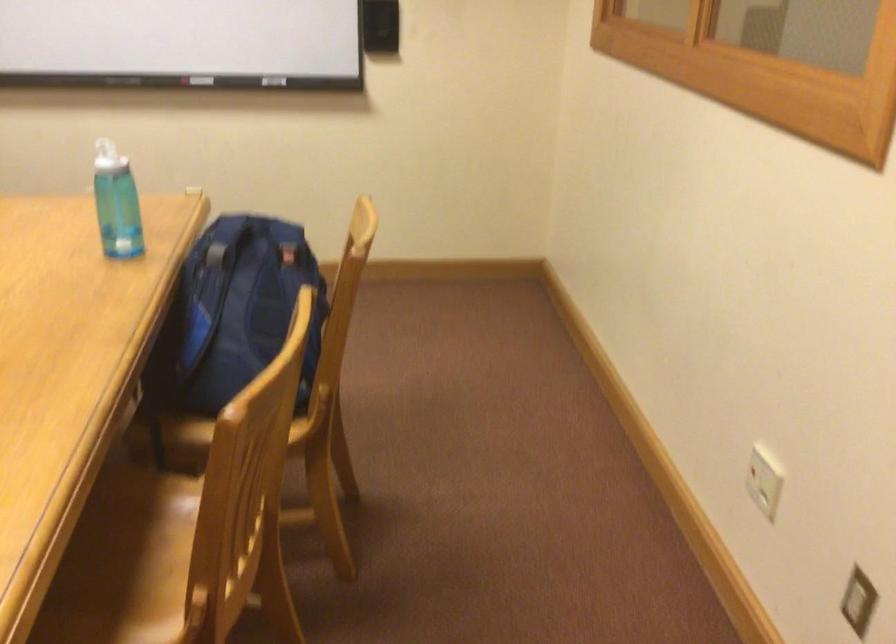
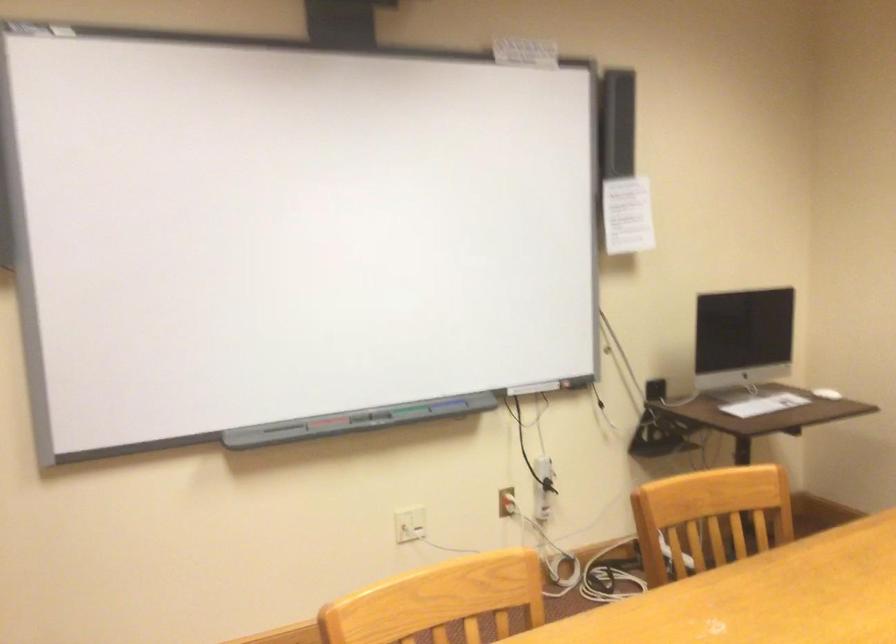
Question: Based on the continuous images, in which direction is the camera rotating? Reply with the corresponding letter.

Choices:
 (A) Left
 (B) Right
 (C) Up
 (D) Down

Answer: (A)